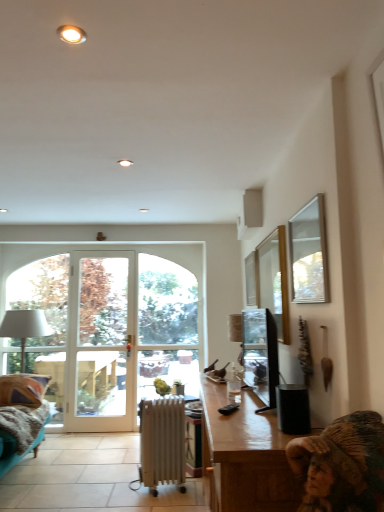
Question: Based on their positions, is white glass door at center located to the left or right of white glass window at center, positioned as the first window in back-to-front order?

Choices:
 (A) right
 (B) left

Answer: (B)

Question: From a real-world perspective, is white glass door at center physically located above or below white glass window at center, the 3th window positioned from the right?

Choices:
 (A) above
 (B) below

Answer: (B)

Question: Based on their relative distances, which object is farther from the white metallic radiator at center?

Choices:
 (A) clear glass window at upper right, the 1th window when ordered from right to left
 (B) white glass door at center
 (C) silver-framed mirror at upper right
 (D) transparent glass window at upper center, arranged as the 2th window when viewed from the front
 (E) satin black television at right

Answer: (C)

Question: Estimate the real-world distances between objects in this image. Which object is farther from the silver-framed mirror at upper right?

Choices:
 (A) white glass window at center, positioned as the first window in back-to-front order
 (B) wooden desk at lower right
 (C) clear glass window at upper right, which ranks as the 3th window in left-to-right order
 (D) plush fabric couch at lower left
 (E) white fabric lampshade at left

Answer: (E)